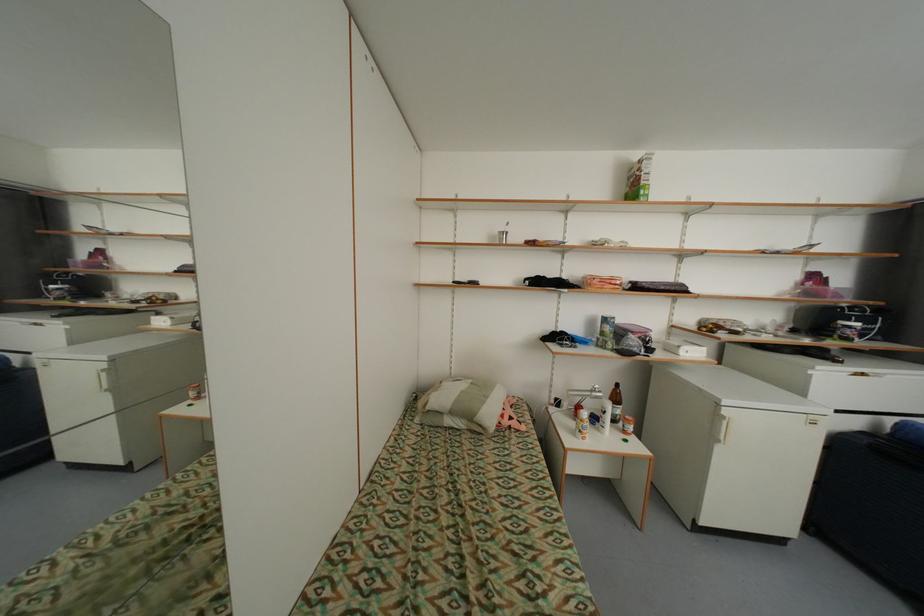
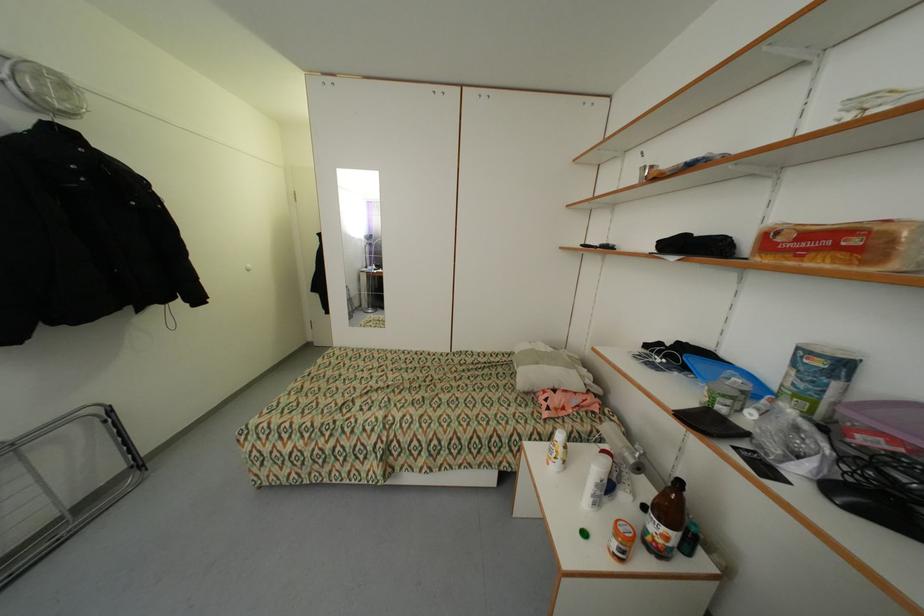
Where in the second image is the point corresponding to (621,284) from the first image?

(860, 241)